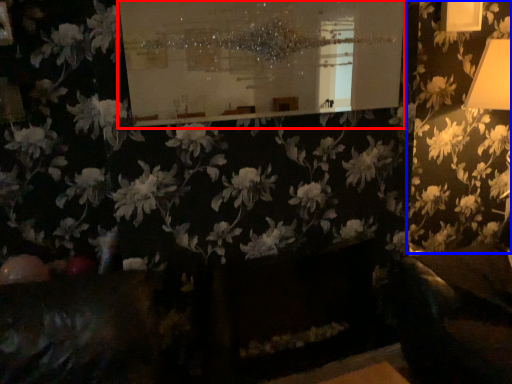
Question: Which of the following is the closest to the observer, bulletin board (highlighted by a red box) or flower (highlighted by a blue box)?

Choices:
 (A) bulletin board
 (B) flower

Answer: (A)